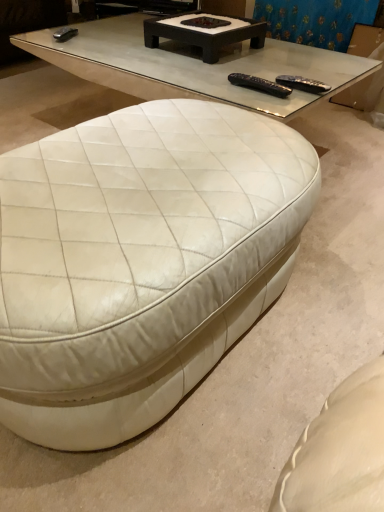
Where is `vacant space in front of black plastic remote at upper center, arranged as the second remote when viewed from the right`? Image resolution: width=384 pixels, height=512 pixels. vacant space in front of black plastic remote at upper center, arranged as the second remote when viewed from the right is located at coordinates (268, 106).